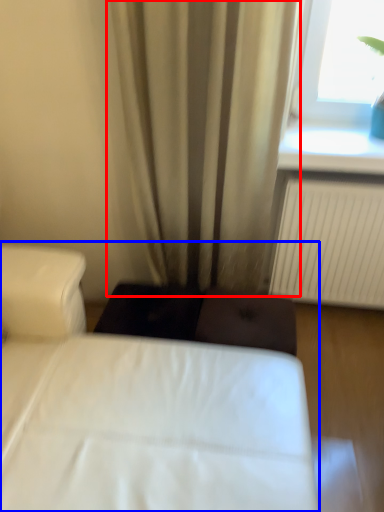
Question: Which object is further to the camera taking this photo, curtain (highlighted by a red box) or bed (highlighted by a blue box)?

Choices:
 (A) curtain
 (B) bed

Answer: (A)